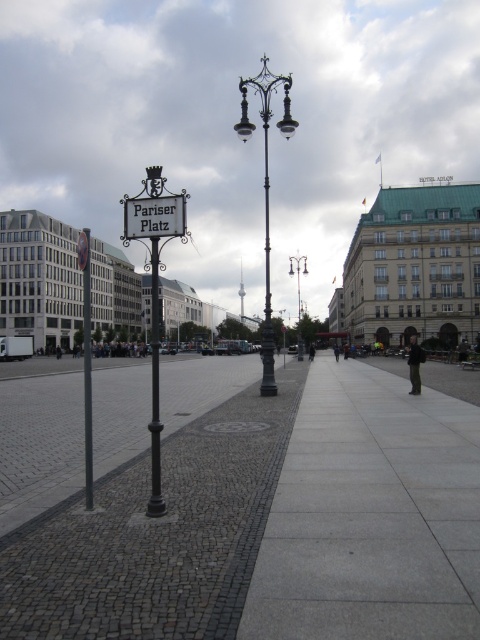
Question: Is polished metal streetlamp at center wider than polished metal streetlight at center?

Choices:
 (A) no
 (B) yes

Answer: (B)

Question: Does white wooden sign at center-left have a smaller size compared to polished metal signpost at center-left?

Choices:
 (A) no
 (B) yes

Answer: (B)

Question: Is polished metal streetlamp at center to the right of polished metal signpost at center-left from the viewer's perspective?

Choices:
 (A) yes
 (B) no

Answer: (A)

Question: Which point appears closest to the camera in this image?

Choices:
 (A) (152, 304)
 (B) (269, 296)
 (C) (179, 438)

Answer: (C)

Question: Which point is closer to the camera?

Choices:
 (A) polished metal pole at center
 (B) polished brass street light at center
 (C) gray cobblestone pavement at center
 (D) white metal sign at center-left

Answer: (C)

Question: Which point appears farthest from the camera in this image?

Choices:
 (A) coord(300,448)
 (B) coord(261,352)
 (C) coord(151,458)
 (D) coord(240,81)

Answer: (B)